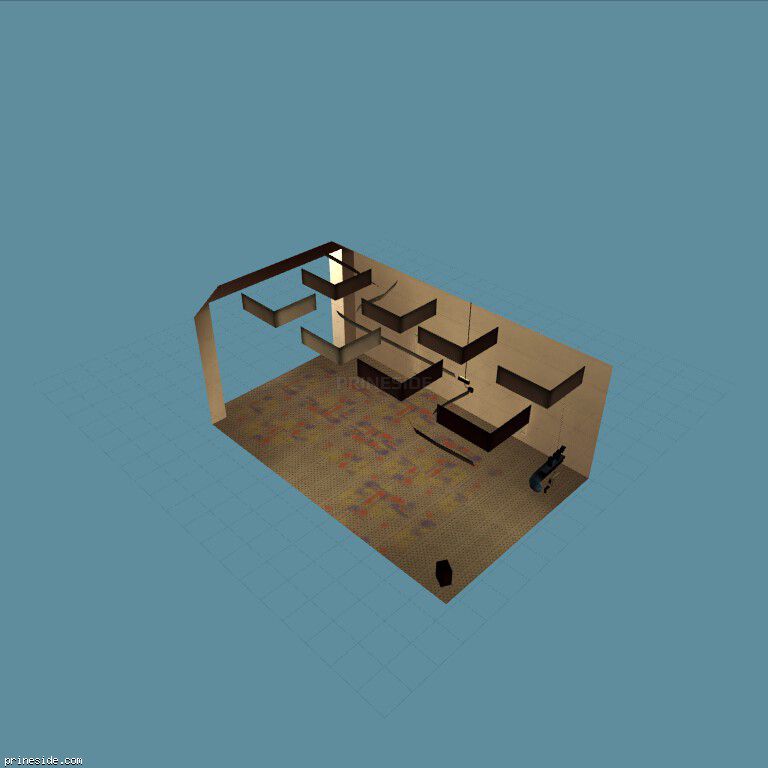
Find the location of a particular element. This screenshot has width=768, height=768. tile is located at coordinates (256, 571).